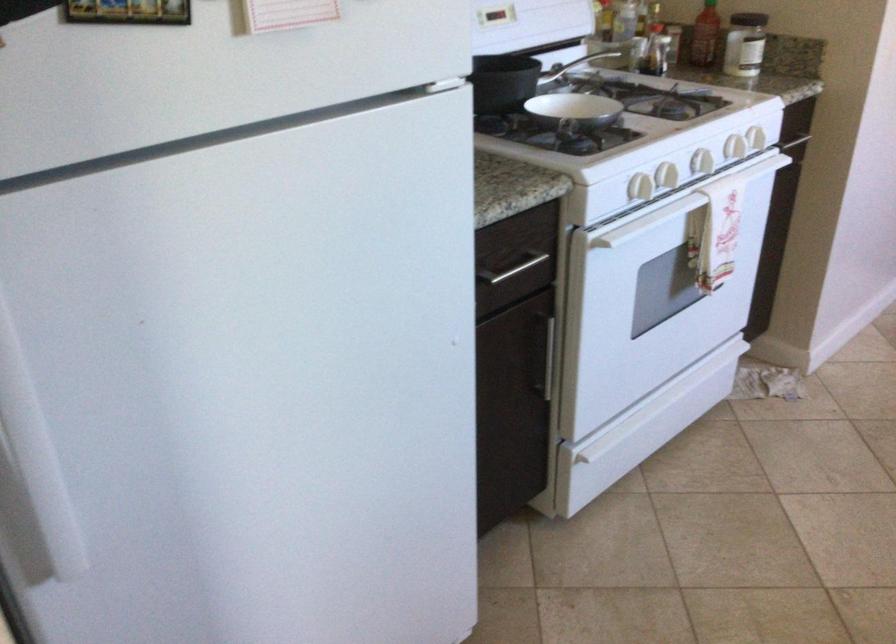
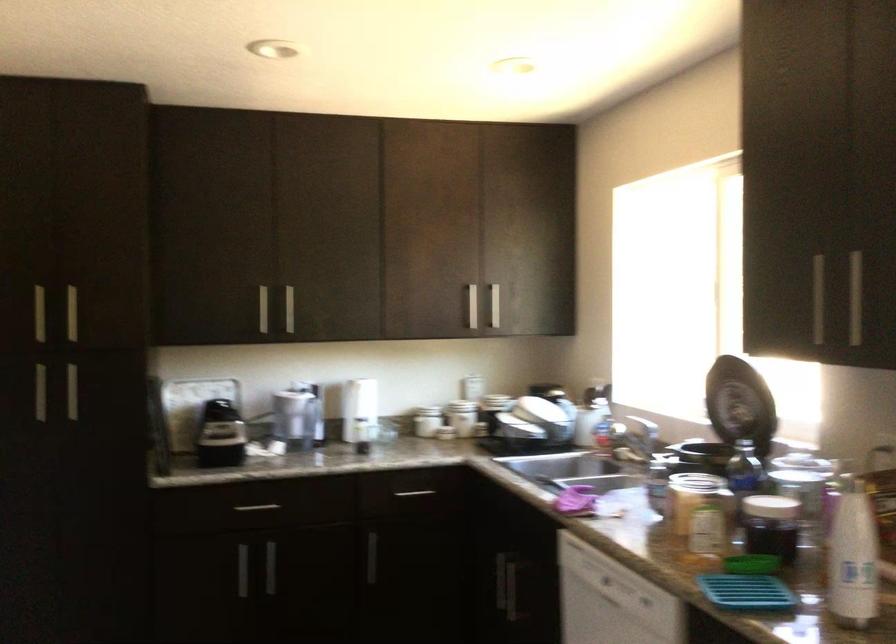
Question: The images are taken continuously from a first-person perspective. In which direction is your viewpoint rotating?

Choices:
 (A) Left
 (B) Right
 (C) Up
 (D) Down

Answer: (B)